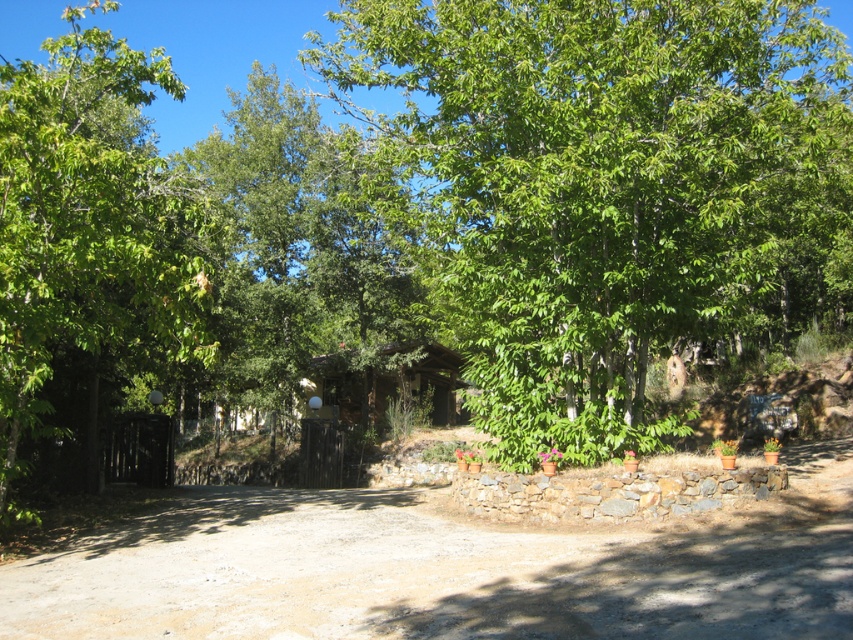
Question: From the image, what is the correct spatial relationship of brown gravel dirt track at lower center in relation to green leafy tree at left?

Choices:
 (A) left
 (B) right

Answer: (B)

Question: Which point appears farthest from the camera in this image?

Choices:
 (A) (0, 77)
 (B) (666, 180)
 (C) (486, 568)

Answer: (B)

Question: Does brown gravel dirt track at lower center have a greater width compared to green leafy tree at left?

Choices:
 (A) no
 (B) yes

Answer: (A)

Question: Is brown gravel dirt track at lower center positioned before green leafy tree at left?

Choices:
 (A) no
 (B) yes

Answer: (B)

Question: Among these points, which one is nearest to the camera?

Choices:
 (A) (161, 234)
 (B) (407, 58)
 (C) (640, 589)

Answer: (C)

Question: Which point is closer to the camera?

Choices:
 (A) (492, 547)
 (B) (10, 234)
 (C) (546, 170)

Answer: (B)